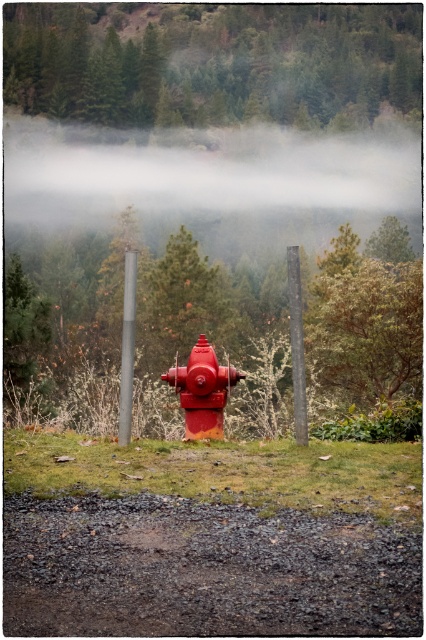
Is green textured bush at right wider than smooth wooden post at center?

Yes, green textured bush at right is wider than smooth wooden post at center.

Does green textured bush at right appear over smooth wooden post at center?

Incorrect, green textured bush at right is not positioned above smooth wooden post at center.

Is point (397, 266) positioned after point (123, 307)?

Yes, it is behind point (123, 307).

What are the coordinates of `green textured bush at right` in the screenshot? It's located at (368, 328).

Can you confirm if green textured bush at right is smaller than matte red fire hydrant at center?

No.

Which is above, green textured bush at right or matte red fire hydrant at center?

Positioned higher is green textured bush at right.

Does point (386, 346) come farther from viewer compared to point (195, 365)?

Yes, point (386, 346) is farther from viewer.

You are a GUI agent. You are given a task and a screenshot of the screen. Output one action in this format:
    pyautogui.click(x=<x>, y=<y>)
    Task: Click on the green textured bush at right
    
    Given the screenshot: What is the action you would take?
    pyautogui.click(x=368, y=328)

Is point (293, 312) positioned behind point (134, 328)?

No, it is in front of (134, 328).

Locate an element on the screen. This screenshot has width=426, height=640. metallic pole at center is located at coordinates (296, 346).

You are a GUI agent. You are given a task and a screenshot of the screen. Output one action in this format:
    pyautogui.click(x=<x>, y=<y>)
    Task: Click on the metallic pole at center
    The width and height of the screenshot is (426, 640).
    Given the screenshot: What is the action you would take?
    pyautogui.click(x=296, y=346)